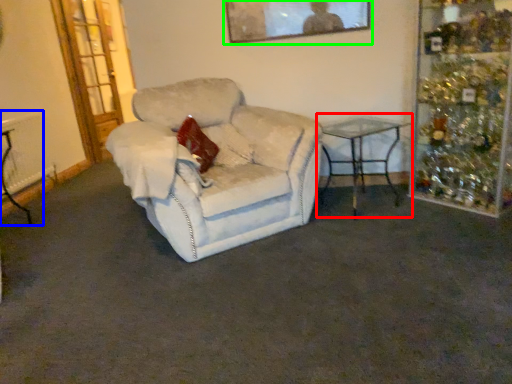
Question: Estimate the real-world distances between objects in this image. Which object is closer to table (highlighted by a red box), table (highlighted by a blue box) or picture frame (highlighted by a green box)?

Choices:
 (A) table
 (B) picture frame

Answer: (B)